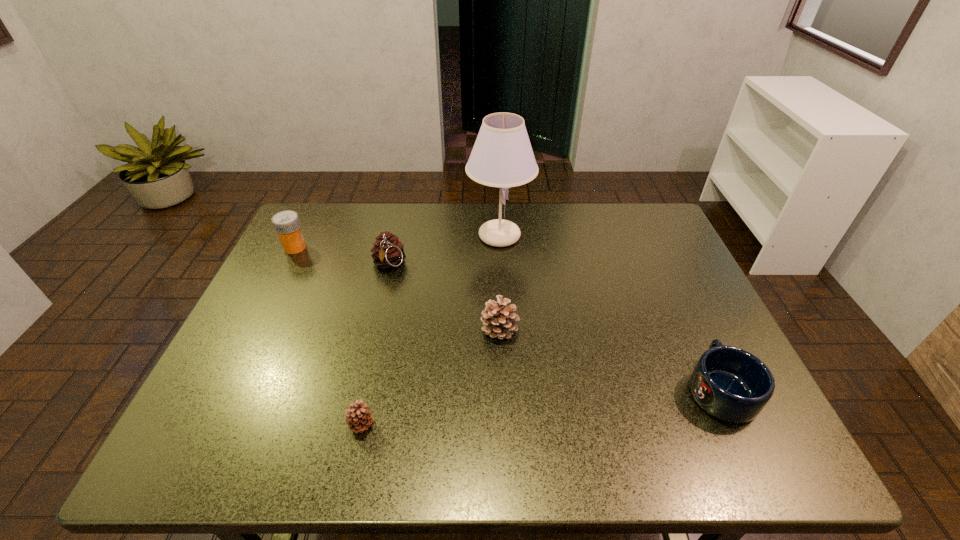
Find the location of `vacant space that satisfies the following two spatial constraints: 1. with a leaf charm attached to the rightmost pinecone; 2. on the right side of the farthest pinecone`. vacant space that satisfies the following two spatial constraints: 1. with a leaf charm attached to the rightmost pinecone; 2. on the right side of the farthest pinecone is located at coordinates (373, 329).

Locate an element on the screen. This screenshot has height=540, width=960. vacant space that satisfies the following two spatial constraints: 1. on the back side of the rightmost pinecone; 2. on the left side of the lampshade is located at coordinates (495, 235).

Image resolution: width=960 pixels, height=540 pixels. I want to click on free space that satisfies the following two spatial constraints: 1. with a leaf charm attached to the farthest pinecone; 2. on the right side of the nearest pinecone, so click(351, 425).

What are the coordinates of `free space in the image that satisfies the following two spatial constraints: 1. with the handle on the side of the rightmost object; 2. on the label side of the medicine` in the screenshot? It's located at click(x=654, y=247).